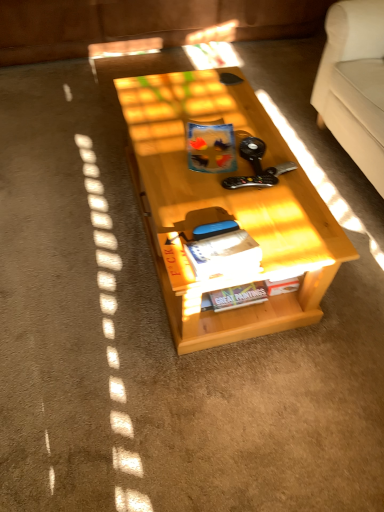
Where is `free space above light wood table at center (from a real-world perspective)`? Image resolution: width=384 pixels, height=512 pixels. free space above light wood table at center (from a real-world perspective) is located at coordinates [220, 146].